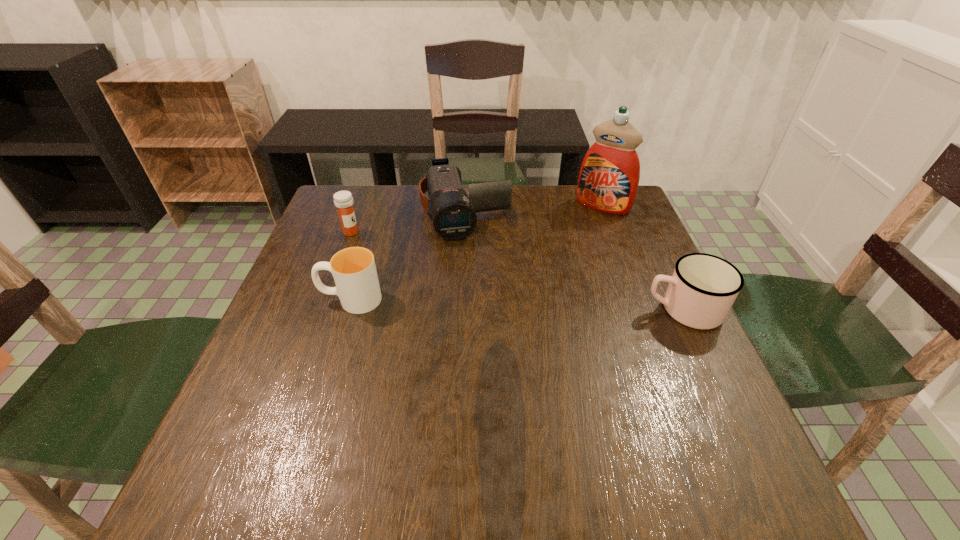
Where is `vacant space situated 0.220m on the side of the mug with the handle`? The height and width of the screenshot is (540, 960). vacant space situated 0.220m on the side of the mug with the handle is located at coordinates (546, 309).

This screenshot has width=960, height=540. I want to click on free space located 0.400m on the lens of the third object from left to right, so click(504, 363).

Identify the location of free space located 0.350m on the lens of the third object from left to right. (499, 344).

Locate an element on the screen. The image size is (960, 540). vacant space located on the lens of the third object from left to right is located at coordinates (489, 303).

The height and width of the screenshot is (540, 960). In order to click on vacant space located 0.100m on the front surface of the tallest object in this screenshot , I will do `click(582, 233)`.

Where is `vacant space located on the front surface of the tallest object`? The height and width of the screenshot is (540, 960). vacant space located on the front surface of the tallest object is located at coordinates (542, 296).

Identify the location of free spot located 0.330m on the front surface of the tallest object. (550, 283).

Locate an element on the screen. This screenshot has width=960, height=540. blank space located on the label side of the medicine is located at coordinates (427, 270).

Locate an element on the screen. The width and height of the screenshot is (960, 540). vacant space situated on the label side of the medicine is located at coordinates (421, 267).

Locate an element on the screen. This screenshot has width=960, height=540. free space located on the label side of the medicine is located at coordinates (473, 293).